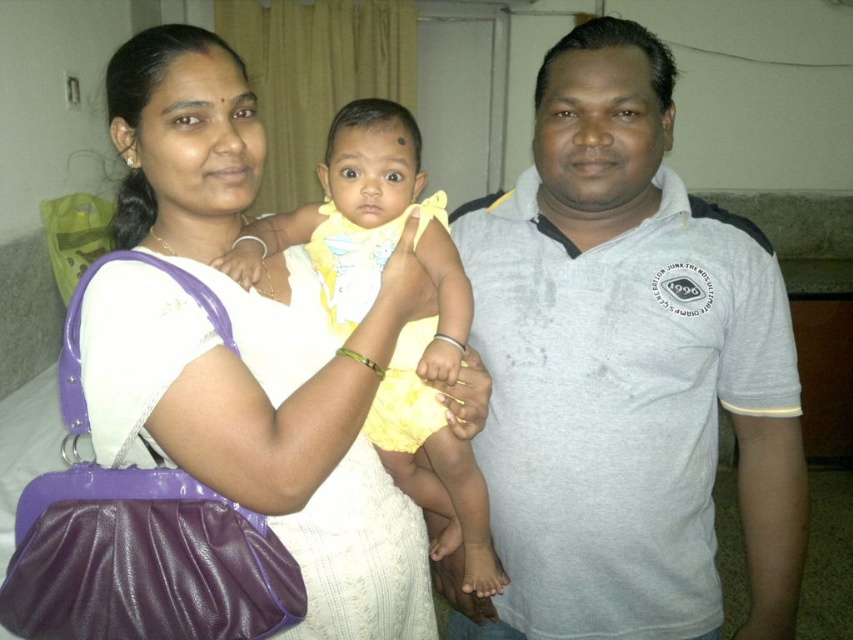
Question: Estimate the real-world distances between objects in this image. Which object is closer to the matte white dress at center?

Choices:
 (A) gray cotton shirt at center
 (B) yellow fabric cloth at center

Answer: (B)

Question: Is gray cotton shirt at center to the left of yellow fabric cloth at center from the viewer's perspective?

Choices:
 (A) no
 (B) yes

Answer: (A)

Question: Does gray cotton shirt at center have a greater width compared to matte white dress at center?

Choices:
 (A) yes
 (B) no

Answer: (A)

Question: Does matte white dress at center have a smaller size compared to yellow fabric cloth at center?

Choices:
 (A) yes
 (B) no

Answer: (B)

Question: Which point is closer to the camera?

Choices:
 (A) gray cotton shirt at center
 (B) matte white dress at center
 (C) yellow fabric cloth at center

Answer: (B)

Question: Estimate the real-world distances between objects in this image. Which object is farther from the gray cotton shirt at center?

Choices:
 (A) yellow fabric cloth at center
 (B) matte white dress at center

Answer: (B)